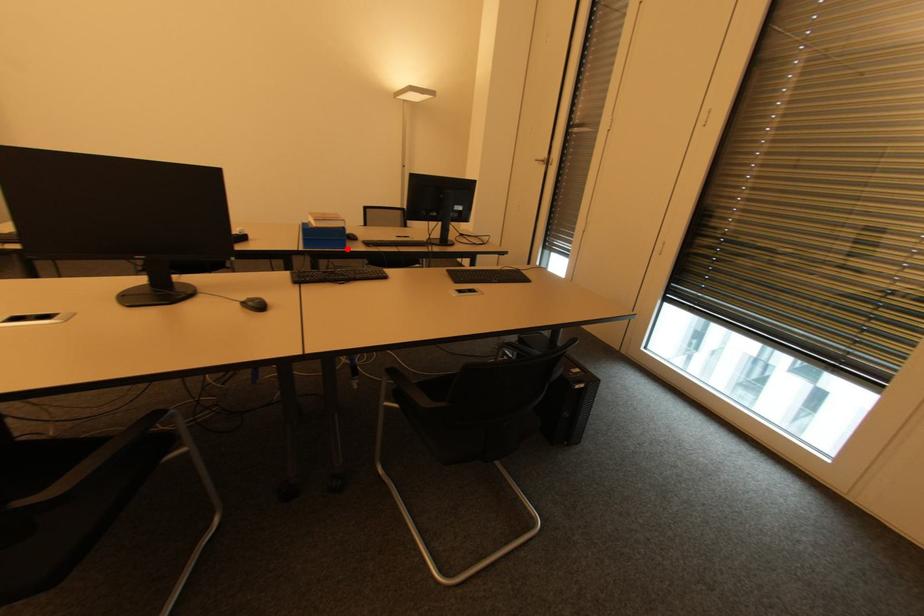
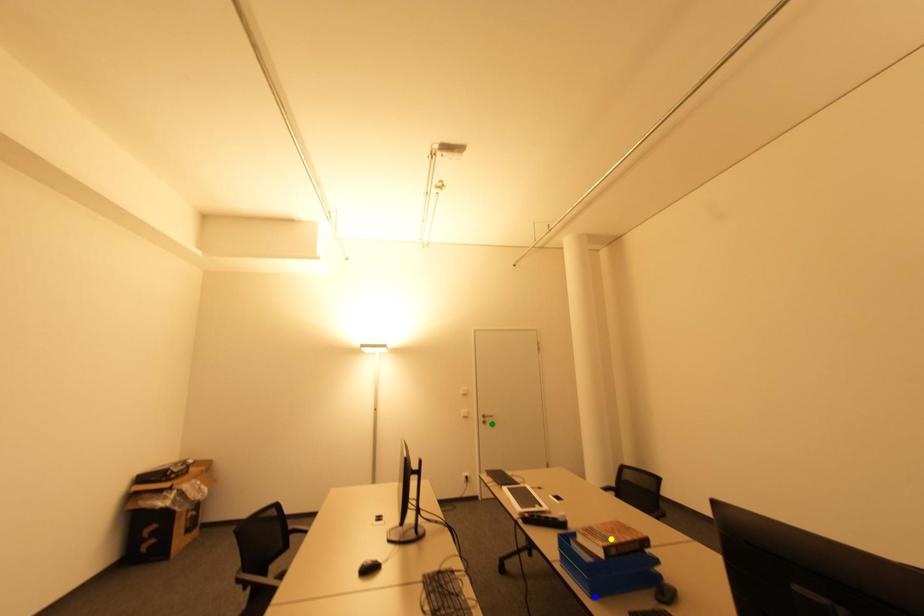
Question: I am providing you with two images of the same scene from different viewpoints. A red point is marked on the first image. You are given multiple points on the second image. Which spot in image 2 lines up with the point in image 1?

Choices:
 (A) yellow point
 (B) green point
 (C) blue point

Answer: (C)